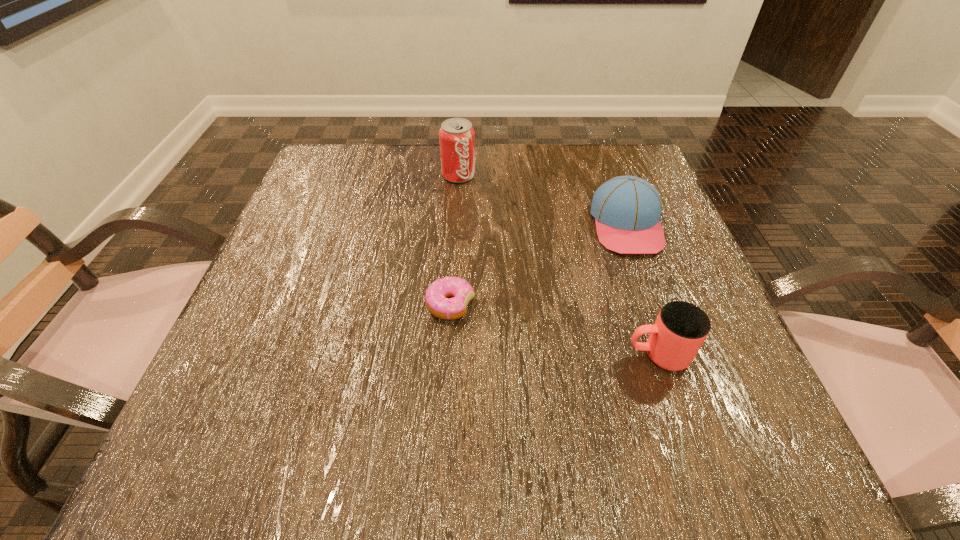
Where is `vacant space at the right edge of the desktop`? The height and width of the screenshot is (540, 960). vacant space at the right edge of the desktop is located at coordinates (694, 268).

Where is `vacant space at the far left corner of the desktop`? The width and height of the screenshot is (960, 540). vacant space at the far left corner of the desktop is located at coordinates (338, 164).

This screenshot has height=540, width=960. I want to click on vacant region at the far right corner, so click(604, 161).

In order to click on vacant space at the near right corner in this screenshot , I will do `click(781, 457)`.

The height and width of the screenshot is (540, 960). Identify the location of free space between the nearest object and the soda can. (558, 265).

What are the coordinates of `vacant area that lies between the baseball cap and the tallest object` in the screenshot? It's located at (542, 200).

Where is `vacant space that is in between the doughnut and the cup`? vacant space that is in between the doughnut and the cup is located at coordinates (554, 329).

Identify the location of free space between the nearest object and the shortest object. Image resolution: width=960 pixels, height=540 pixels. (554, 329).

The image size is (960, 540). Identify the location of free space between the doughnut and the cup. (554, 329).

At what (x,y) coordinates should I click in order to perform the action: click on vacant space that's between the nearest object and the baseball cap. Please return your answer as a coordinate pair (x, y). Image resolution: width=960 pixels, height=540 pixels. Looking at the image, I should click on (642, 290).